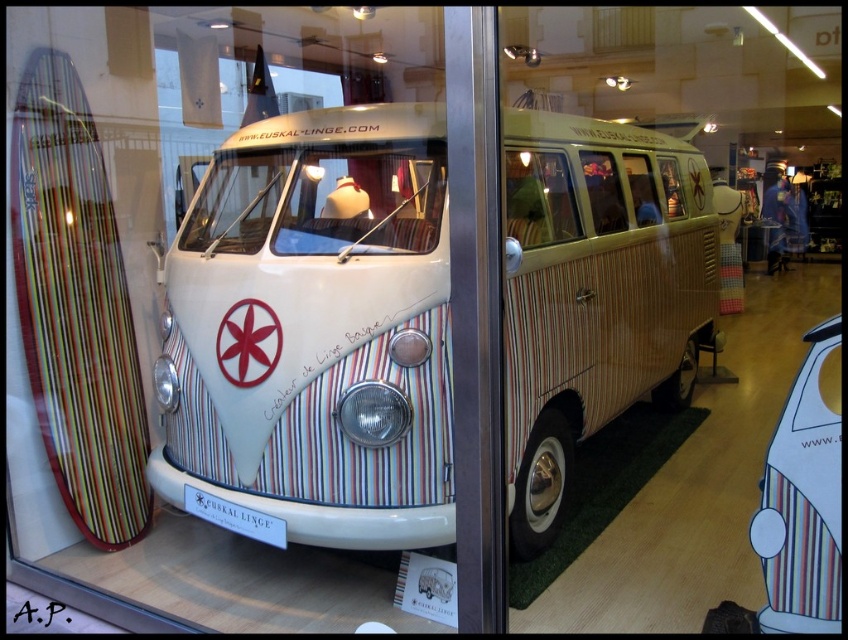
Is point (67, 157) closer to camera compared to point (793, 461)?

No.

Find the location of a particular element. The image size is (848, 640). multicolored striped surfboard at left is located at coordinates (76, 307).

Is point (514, 204) positioned behind point (7, 330)?

No, (514, 204) is closer to viewer.

Looking at this image, can you confirm if white striped van at center is taller than multicolored striped surfboard at left?

Correct, white striped van at center is much taller as multicolored striped surfboard at left.

Is point (568, 227) farther from viewer compared to point (93, 156)?

Yes, it is behind point (93, 156).

Where is `white striped van at center`? white striped van at center is located at coordinates (314, 333).

From the picture: Does white striped van at center have a smaller size compared to striped fabric van at center?

Actually, white striped van at center might be larger than striped fabric van at center.

Can you confirm if white striped van at center is positioned to the right of striped fabric van at center?

Incorrect, white striped van at center is not on the right side of striped fabric van at center.

Does point (266, 358) come in front of point (835, 454)?

No, (266, 358) is further to viewer.

Locate an element on the screen. This screenshot has width=848, height=640. white striped van at center is located at coordinates pos(314,333).